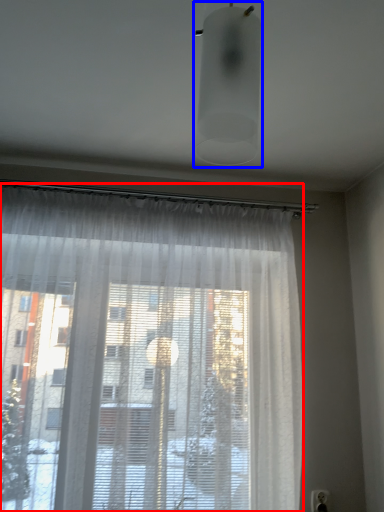
Question: Which object appears closest to the camera in this image, curtain (highlighted by a red box) or light fixture (highlighted by a blue box)?

Choices:
 (A) curtain
 (B) light fixture

Answer: (B)